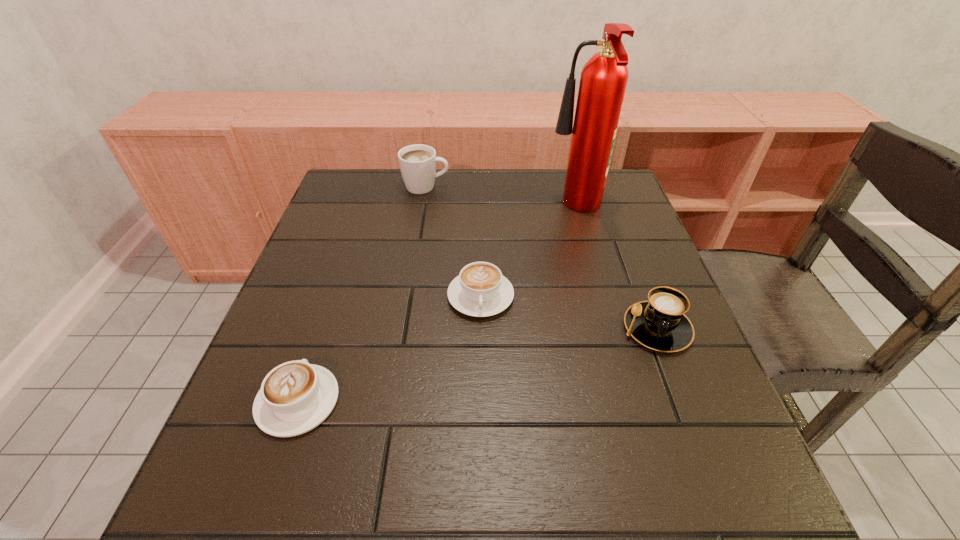
The width and height of the screenshot is (960, 540). What are the coordinates of `free space located at the nozzle of the fire extinguisher` in the screenshot? It's located at [479, 209].

Locate an element on the screen. free space located 0.380m with the handle on the side of the second cappuccino from left to right is located at coordinates (581, 187).

Where is `free space located on the back of the third shortest object`? This screenshot has height=540, width=960. free space located on the back of the third shortest object is located at coordinates (615, 221).

Locate an element on the screen. The width and height of the screenshot is (960, 540). vacant region located on the side of the third object from left to right with the handle is located at coordinates (481, 366).

The image size is (960, 540). What are the coordinates of `vacant space situated with the handle on the right side of the leftmost cappuccino` in the screenshot? It's located at (344, 267).

At what (x,y) coordinates should I click in order to perform the action: click on free space located 0.090m with the handle on the right side of the leftmost cappuccino. Please return your answer as a coordinate pair (x, y). Looking at the image, I should click on (322, 330).

Where is `vacant point located with the handle on the right side of the leftmost cappuccino`? The height and width of the screenshot is (540, 960). vacant point located with the handle on the right side of the leftmost cappuccino is located at coordinates coord(329,308).

Where is `fire extinguisher located in the far edge section of the desktop`? This screenshot has width=960, height=540. fire extinguisher located in the far edge section of the desktop is located at coordinates (603, 80).

Where is `cappuccino present at the far edge`? The image size is (960, 540). cappuccino present at the far edge is located at coordinates (417, 162).

I want to click on object at the left edge, so click(295, 397).